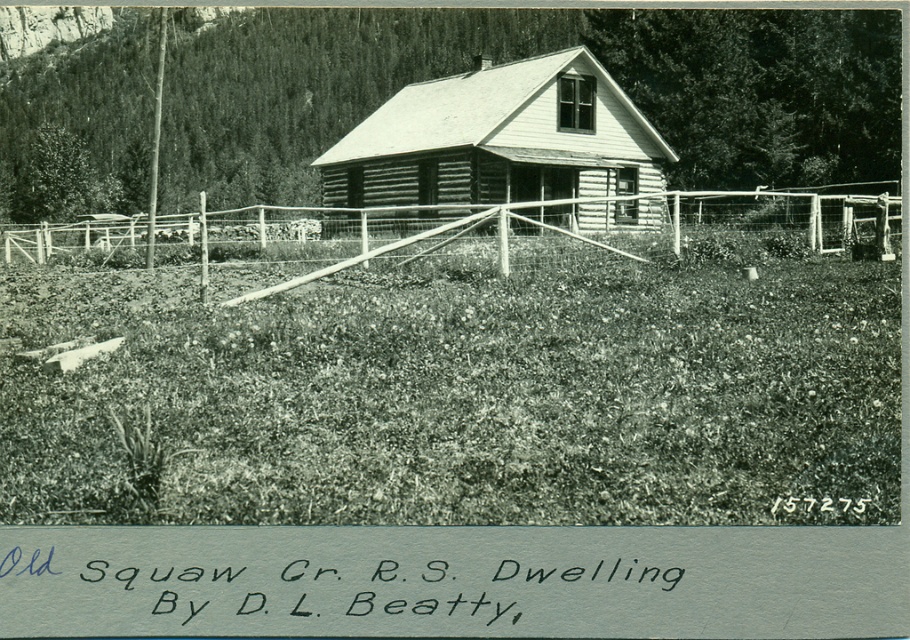
Question: Does grassy at center appear on the left side of wooden cabin at center?

Choices:
 (A) no
 (B) yes

Answer: (B)

Question: Does grassy at center come in front of wooden cabin at center?

Choices:
 (A) yes
 (B) no

Answer: (A)

Question: Is grassy at center thinner than wooden cabin at center?

Choices:
 (A) no
 (B) yes

Answer: (B)

Question: Estimate the real-world distances between objects in this image. Which object is farther from the wooden fence at center?

Choices:
 (A) grassy at center
 (B) wooden cabin at center

Answer: (A)

Question: Which is nearer to the grassy at center?

Choices:
 (A) wooden cabin at center
 (B) wooden fence at center

Answer: (B)

Question: Which of these objects is positioned closest to the wooden cabin at center?

Choices:
 (A) wooden fence at center
 (B) grassy at center

Answer: (A)